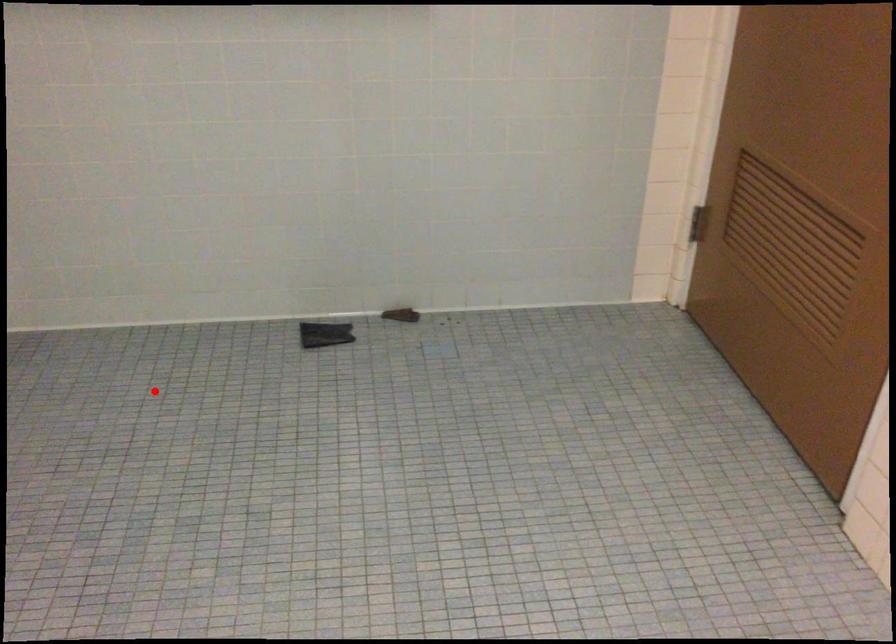
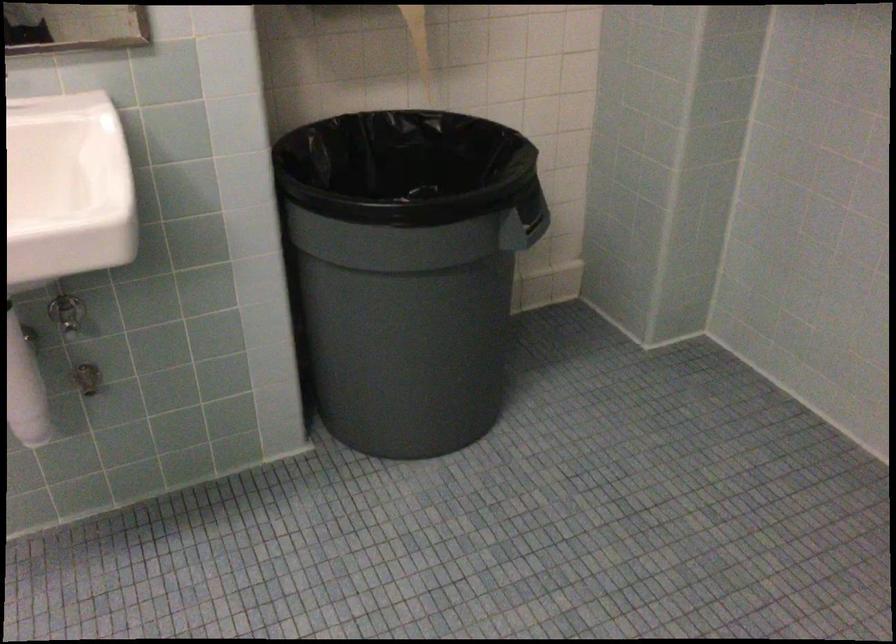
Locate, in the second image, the point that corresponds to the highlighted location in the first image.

(745, 469)